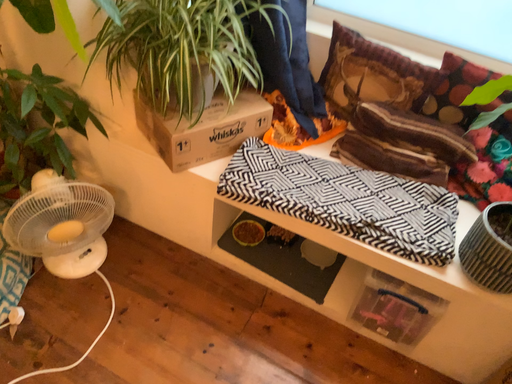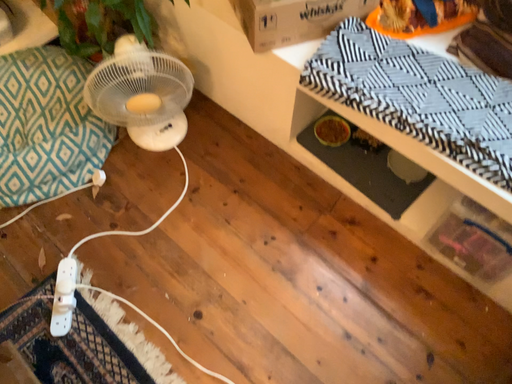
Question: How did the camera likely rotate when shooting the video?

Choices:
 (A) rotated downward
 (B) rotated upward

Answer: (A)